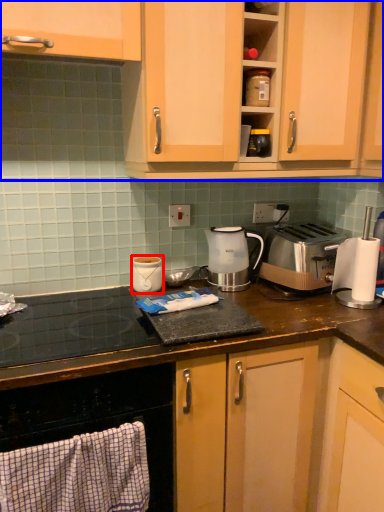
Question: Which point is closer to the camera, kitchen appliance (highlighted by a red box) or cabinetry (highlighted by a blue box)?

Choices:
 (A) kitchen appliance
 (B) cabinetry

Answer: (B)